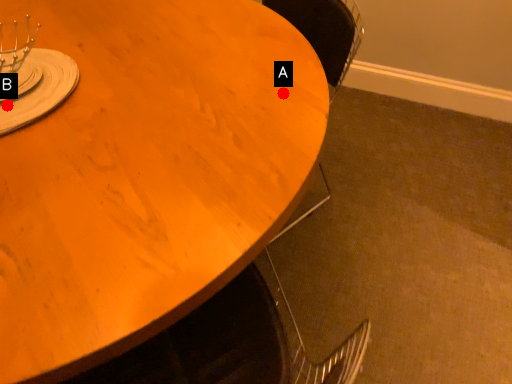
Question: Two points are circled on the image, labeled by A and B beside each circle. Which point appears closest to the camera in this image?

Choices:
 (A) A is closer
 (B) B is closer

Answer: (B)